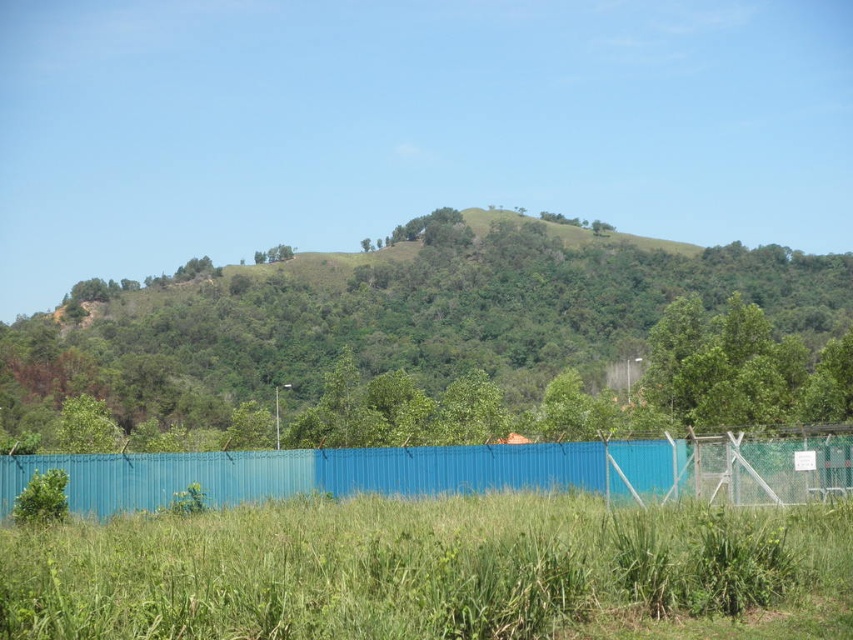
You are a painter standing in front of the scene. You want to paint the green leafy tree at center and the blue corrugated metal fence at lower center. Which object should you focus on first if you want to paint the larger one first?

The green leafy tree at center is bigger than the blue corrugated metal fence at lower center, so you should focus on painting the green leafy tree at center first.